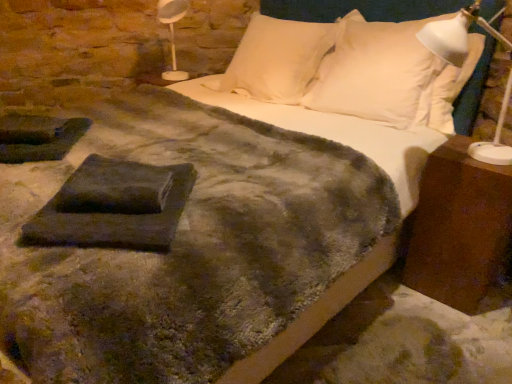
Question: Does dark gray felt at center have a lesser width compared to white plastic lamp at right?

Choices:
 (A) yes
 (B) no

Answer: (A)

Question: Is there a large distance between dark gray felt at center and white plastic lamp at right?

Choices:
 (A) yes
 (B) no

Answer: (A)

Question: Can you confirm if dark gray felt at center is wider than white plastic lamp at right?

Choices:
 (A) yes
 (B) no

Answer: (B)

Question: Could you tell me if dark gray felt at center is turned towards white plastic lamp at right?

Choices:
 (A) yes
 (B) no

Answer: (B)

Question: Can you confirm if dark gray felt at center is positioned to the left of white plastic lamp at right?

Choices:
 (A) yes
 (B) no

Answer: (A)

Question: Do you think white soft pillow at upper right, which is the first pillow in right-to-left order, is within white soft pillow at upper center, the 2th pillow viewed from the right, or outside of it?

Choices:
 (A) inside
 (B) outside

Answer: (B)

Question: From a real-world perspective, relative to white soft pillow at upper center, placed as the first pillow when sorted from left to right, is white soft pillow at upper right, which is the first pillow in right-to-left order, vertically above or below?

Choices:
 (A) above
 (B) below

Answer: (A)

Question: Considering the positions of point (410, 87) and point (269, 92), is point (410, 87) closer or farther from the camera than point (269, 92)?

Choices:
 (A) closer
 (B) farther

Answer: (A)

Question: In terms of height, does white soft pillow at upper right, which is the second pillow in left-to-right order, look taller or shorter compared to white soft pillow at upper center, placed as the first pillow when sorted from left to right?

Choices:
 (A) short
 (B) tall

Answer: (B)

Question: Is point (393, 69) closer or farther from the camera than point (88, 178)?

Choices:
 (A) farther
 (B) closer

Answer: (A)

Question: Visually, is white soft pillow at upper right, which is the second pillow in left-to-right order, positioned to the left or to the right of dark gray felt at center?

Choices:
 (A) left
 (B) right

Answer: (B)

Question: Would you say white soft pillow at upper right, which is the first pillow in right-to-left order, is inside or outside dark gray felt at center?

Choices:
 (A) inside
 (B) outside

Answer: (B)

Question: In terms of height, does white soft pillow at upper right, which is the second pillow in left-to-right order, look taller or shorter compared to dark gray felt at center?

Choices:
 (A) tall
 (B) short

Answer: (A)

Question: In the image, is dark gray felt at center positioned in front of or behind white soft pillow at upper right, which is the first pillow in right-to-left order?

Choices:
 (A) behind
 (B) front

Answer: (B)

Question: Considering the positions of dark gray felt at center and white soft pillow at upper right, which is the first pillow in right-to-left order, in the image, is dark gray felt at center taller or shorter than white soft pillow at upper right, which is the first pillow in right-to-left order,?

Choices:
 (A) short
 (B) tall

Answer: (A)